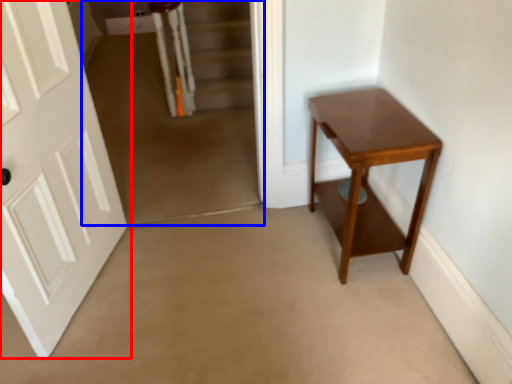
Question: Which of the following is the farthest to the observer, door (highlighted by a red box) or corridor (highlighted by a blue box)?

Choices:
 (A) door
 (B) corridor

Answer: (B)